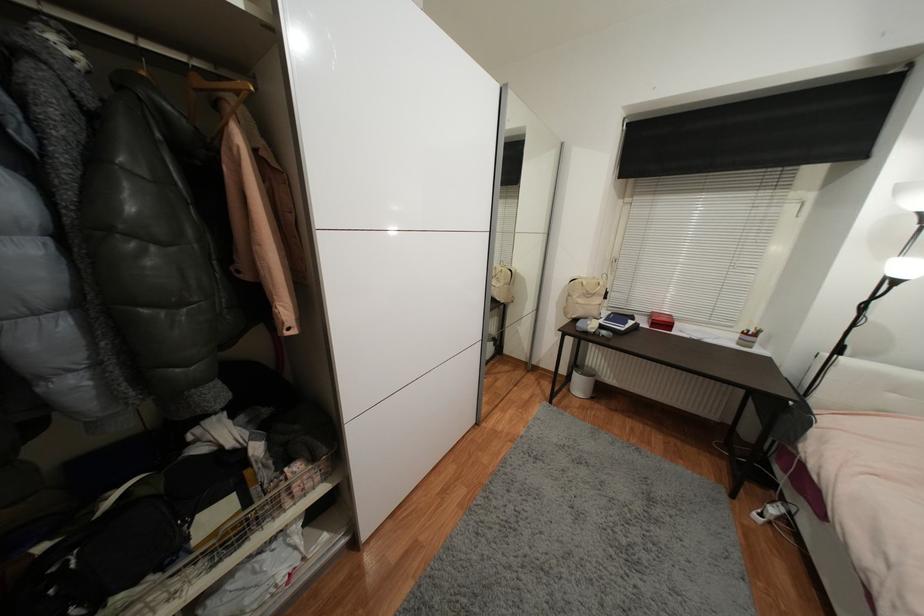
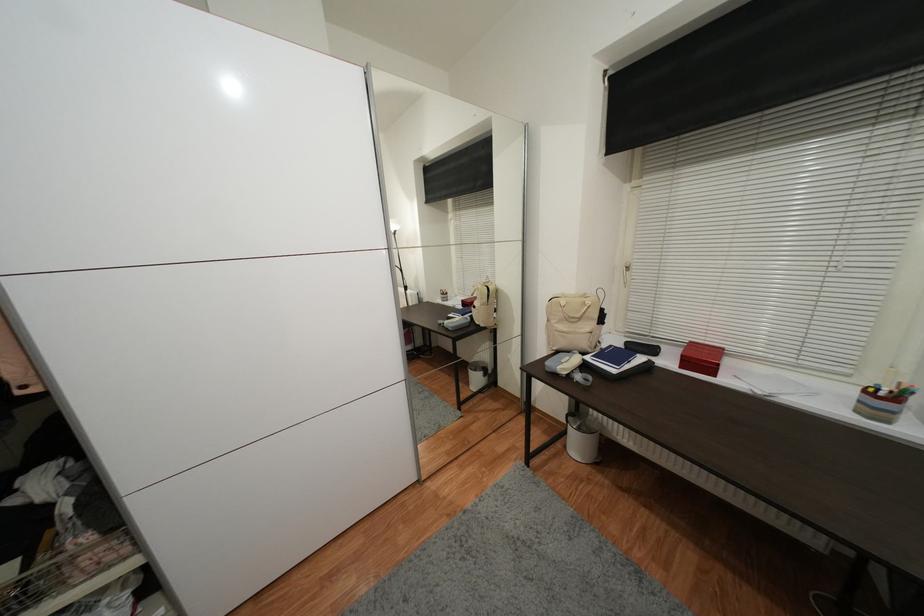
Find the pixel in the second image that matches point 660,195 in the first image.

(678, 167)